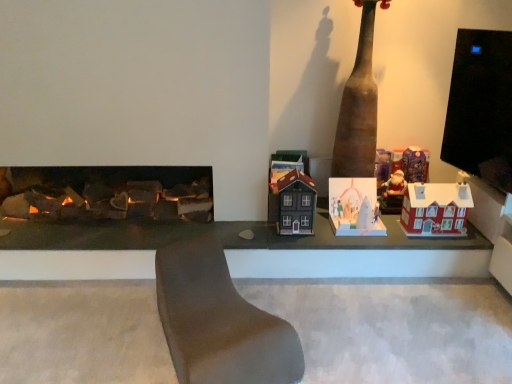
Locate an element on the screen. The width and height of the screenshot is (512, 384). brown leather couch at center is located at coordinates (219, 322).

I want to click on white paper house at center, arranged as the 2th toy when viewed from the left, so click(x=354, y=207).

Identify the location of brown leather couch at center. This screenshot has width=512, height=384. (219, 322).

Could you tell me if brown leather couch at center is turned towards brown matte totem pole at center?

No, brown leather couch at center does not turn towards brown matte totem pole at center.

Find the location of a particular element. The width and height of the screenshot is (512, 384). furniture on the left side of brown matte totem pole at center is located at coordinates (219, 322).

Between brown leather couch at center and brown matte totem pole at center, which one is positioned in front?

brown leather couch at center is in front.

Which object is closer to the camera, brown matte totem pole at center or brown leather couch at center?

Positioned in front is brown leather couch at center.

Which is correct: brown matte totem pole at center is inside brown leather couch at center, or outside of it?

brown matte totem pole at center is located beyond the bounds of brown leather couch at center.

From a real-world perspective, is brown matte totem pole at center above or below brown leather couch at center?

In terms of real-world spatial position, brown matte totem pole at center is above brown leather couch at center.

Is brown matte totem pole at center facing towards brown leather couch at center?

No, brown matte totem pole at center is not aimed at brown leather couch at center.

Can we say red matte house at right, arranged as the 4th toy when viewed from the left, lies outside brown leather couch at center?

Absolutely, red matte house at right, arranged as the 4th toy when viewed from the left, is external to brown leather couch at center.

Is red matte house at right, the first toy positioned from the right, wider or thinner than brown leather couch at center?

In the image, red matte house at right, the first toy positioned from the right, appears to be more narrow than brown leather couch at center.

Is there a large distance between red matte house at right, the first toy positioned from the right, and brown leather couch at center?

Yes, red matte house at right, the first toy positioned from the right, is far from brown leather couch at center.

From a real-world perspective, starting from the brown leather couch at center, which toy is the 2nd one vertically above it? Please provide its 2D coordinates.

[(435, 209)]

Between shiny purple wrapping paper at upper right, the third toy when ordered from left to right, and white paper house at center, which is the 3th toy in right-to-left order, which one has larger size?

white paper house at center, which is the 3th toy in right-to-left order, is bigger.

How distant is shiny purple wrapping paper at upper right, positioned as the 2th toy in right-to-left order, from white paper house at center, arranged as the 2th toy when viewed from the left?

shiny purple wrapping paper at upper right, positioned as the 2th toy in right-to-left order, and white paper house at center, arranged as the 2th toy when viewed from the left, are 49.30 centimeters apart.

From the image's perspective, is shiny purple wrapping paper at upper right, the third toy when ordered from left to right, above or below white paper house at center, which is the 3th toy in right-to-left order?

Clearly, from the image's perspective, shiny purple wrapping paper at upper right, the third toy when ordered from left to right, is above white paper house at center, which is the 3th toy in right-to-left order.

Is shiny purple wrapping paper at upper right, positioned as the 2th toy in right-to-left order, further to the viewer compared to white paper house at center, arranged as the 2th toy when viewed from the left?

Yes, it is behind white paper house at center, arranged as the 2th toy when viewed from the left.

Could you measure the distance between red matte house at right, the first toy positioned from the right, and white paper house at center, which is the 3th toy in right-to-left order?

A distance of 13.64 inches exists between red matte house at right, the first toy positioned from the right, and white paper house at center, which is the 3th toy in right-to-left order.

From the image's perspective, is red matte house at right, the first toy positioned from the right, over white paper house at center, which is the 3th toy in right-to-left order?

Yes, from the image's perspective, red matte house at right, the first toy positioned from the right, is above white paper house at center, which is the 3th toy in right-to-left order.

Who is smaller, red matte house at right, the first toy positioned from the right, or white paper house at center, arranged as the 2th toy when viewed from the left?

With smaller size is white paper house at center, arranged as the 2th toy when viewed from the left.

Can you confirm if red matte house at right, arranged as the 4th toy when viewed from the left, is thinner than white paper house at center, which is the 3th toy in right-to-left order?

Correct, the width of red matte house at right, arranged as the 4th toy when viewed from the left, is less than that of white paper house at center, which is the 3th toy in right-to-left order.

Can you confirm if shiny purple wrapping paper at upper right, the third toy when ordered from left to right, is bigger than brown matte totem pole at center?

No.

From the image's perspective, is shiny purple wrapping paper at upper right, positioned as the 2th toy in right-to-left order, on top of brown matte totem pole at center?

Incorrect, from the image's perspective, shiny purple wrapping paper at upper right, positioned as the 2th toy in right-to-left order, is lower than brown matte totem pole at center.

At what (x,y) coordinates should I click in order to perform the action: click on totem pole lying on the left of shiny purple wrapping paper at upper right, the third toy when ordered from left to right. Please return your answer as a coordinate pair (x, y). This screenshot has height=384, width=512. Looking at the image, I should click on (359, 106).

In the scene shown: Choose the correct answer: Is brown matte totem pole at center inside white paper house at center, which is the 3th toy in right-to-left order, or outside it?

brown matte totem pole at center is not inside white paper house at center, which is the 3th toy in right-to-left order, it's outside.

From the image's perspective, is brown matte totem pole at center on top of white paper house at center, arranged as the 2th toy when viewed from the left?

Yes.

Considering the positions of points (373, 1) and (359, 200), is point (373, 1) farther from camera compared to point (359, 200)?

No, it is not.

Which object is closer to the camera, brown matte totem pole at center or white paper house at center, which is the 3th toy in right-to-left order?

Positioned in front is brown matte totem pole at center.

Find the location of `totem pole on the right of brown leather couch at center`. totem pole on the right of brown leather couch at center is located at coordinates (359, 106).

I want to click on furniture in front of the brown matte totem pole at center, so click(x=219, y=322).

Looking at the image, which one is located further to matte brown house at center, the 1th toy from the left, red matte house at right, the first toy positioned from the right, or white paper house at center, arranged as the 2th toy when viewed from the left?

red matte house at right, the first toy positioned from the right, lies further to matte brown house at center, the 1th toy from the left, than the other object.

Which object lies further to the anchor point brown matte totem pole at center, brown leather couch at center or white paper house at center, which is the 3th toy in right-to-left order?

brown leather couch at center.

From the image, which object appears to be nearer to brown leather couch at center, shiny purple wrapping paper at upper right, the third toy when ordered from left to right, or white paper house at center, arranged as the 2th toy when viewed from the left?

white paper house at center, arranged as the 2th toy when viewed from the left, is closer to brown leather couch at center.

Considering their positions, is brown matte totem pole at center positioned closer to red matte house at right, arranged as the 4th toy when viewed from the left, than shiny purple wrapping paper at upper right, positioned as the 2th toy in right-to-left order?

Based on the image, shiny purple wrapping paper at upper right, positioned as the 2th toy in right-to-left order, appears to be nearer to red matte house at right, arranged as the 4th toy when viewed from the left.

From the image, which object appears to be farther from matte brown house at center, acting as the 4th toy starting from the right, white paper house at center, which is the 3th toy in right-to-left order, or brown leather couch at center?

brown leather couch at center lies further to matte brown house at center, acting as the 4th toy starting from the right, than the other object.

When comparing their distances from red matte house at right, arranged as the 4th toy when viewed from the left, does matte brown house at center, acting as the 4th toy starting from the right, or brown leather couch at center seem closer?

Based on the image, matte brown house at center, acting as the 4th toy starting from the right, appears to be nearer to red matte house at right, arranged as the 4th toy when viewed from the left.

Considering their positions, is red matte house at right, arranged as the 4th toy when viewed from the left, positioned further to brown matte totem pole at center than white paper house at center, which is the 3th toy in right-to-left order?

red matte house at right, arranged as the 4th toy when viewed from the left, lies further to brown matte totem pole at center than the other object.

When comparing their distances from matte brown house at center, the 1th toy from the left, does brown matte totem pole at center or red matte house at right, the first toy positioned from the right, seem closer?

The object closer to matte brown house at center, the 1th toy from the left, is brown matte totem pole at center.

Where is `totem pole between matte brown house at center, the 1th toy from the left, and shiny purple wrapping paper at upper right, the third toy when ordered from left to right`? totem pole between matte brown house at center, the 1th toy from the left, and shiny purple wrapping paper at upper right, the third toy when ordered from left to right is located at coordinates point(359,106).

You are a GUI agent. You are given a task and a screenshot of the screen. Output one action in this format:
    pyautogui.click(x=<x>, y=<y>)
    Task: Click on the toy between matte brown house at center, acting as the 4th toy starting from the right, and shiny purple wrapping paper at upper right, the third toy when ordered from left to right
    The width and height of the screenshot is (512, 384).
    Given the screenshot: What is the action you would take?
    pyautogui.click(x=354, y=207)

Find the location of a particular element. This screenshot has height=384, width=512. totem pole between brown leather couch at center and matte brown house at center, acting as the 4th toy starting from the right, in the front-back direction is located at coordinates (359, 106).

Identify the location of toy situated between white paper house at center, which is the 3th toy in right-to-left order, and red matte house at right, the first toy positioned from the right, from left to right. Image resolution: width=512 pixels, height=384 pixels. (415, 164).